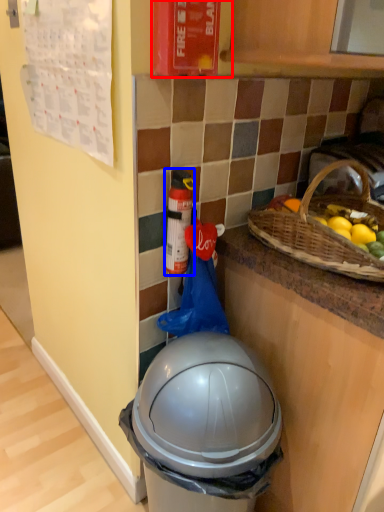
Question: Which object is further to the camera taking this photo, fire extinguisher (highlighted by a red box) or bottle (highlighted by a blue box)?

Choices:
 (A) fire extinguisher
 (B) bottle

Answer: (B)